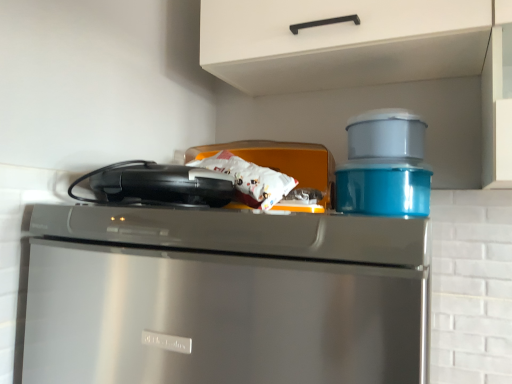
The image size is (512, 384). What do you see at coordinates (224, 297) in the screenshot?
I see `stainless steel dishwasher at upper center` at bounding box center [224, 297].

Identify the location of matte plastic container at upper right, placed as the second appliance when sorted from left to right. (386, 134).

Find the location of a particular element. This screenshot has width=512, height=384. orange plastic container at center, the first appliance when ordered from left to right is located at coordinates (281, 160).

What do you see at coordinates (158, 184) in the screenshot? I see `black plastic toaster at upper left` at bounding box center [158, 184].

Find the location of a particular element. glossy plastic container at upper right, the third appliance from the left is located at coordinates (385, 165).

Can you see orange plastic container at center, the first appliance when ordered from left to right, touching matte plastic container at upper right, the second appliance from the right?

No, orange plastic container at center, the first appliance when ordered from left to right, is not touching matte plastic container at upper right, the second appliance from the right.

Considering the sizes of objects orange plastic container at center, the first appliance when ordered from left to right, and matte plastic container at upper right, placed as the second appliance when sorted from left to right, in the image provided, who is smaller, orange plastic container at center, the first appliance when ordered from left to right, or matte plastic container at upper right, placed as the second appliance when sorted from left to right,?

orange plastic container at center, the first appliance when ordered from left to right, is smaller.

Do you think orange plastic container at center, placed as the 3th appliance when sorted from right to left, is within matte plastic container at upper right, the second appliance from the right, or outside of it?

orange plastic container at center, placed as the 3th appliance when sorted from right to left, is not enclosed by matte plastic container at upper right, the second appliance from the right.

How different are the orientations of orange plastic container at center, the first appliance when ordered from left to right, and matte plastic container at upper right, the second appliance from the right, in degrees?

A: The angle between the facing direction of orange plastic container at center, the first appliance when ordered from left to right, and the facing direction of matte plastic container at upper right, the second appliance from the right, is 0.000131 degrees.

Is white matte cabinet handle at upper center further to camera compared to black plastic toaster at upper left?

Yes, the depth of white matte cabinet handle at upper center is greater than that of black plastic toaster at upper left.

From the image's perspective, which is below, white matte cabinet handle at upper center or black plastic toaster at upper left?

black plastic toaster at upper left appears lower in the image.

From a real-world perspective, is white matte cabinet handle at upper center physically located above or below black plastic toaster at upper left?

Clearly, from a real-world perspective, white matte cabinet handle at upper center is above black plastic toaster at upper left.

Can you confirm if stainless steel dishwasher at upper center is shorter than glossy plastic container at upper right, the third appliance from the left?

Incorrect, the height of stainless steel dishwasher at upper center does not fall short of that of glossy plastic container at upper right, the third appliance from the left.

Based on the photo, from a real-world perspective, which object stands above the other?

glossy plastic container at upper right, the third appliance from the left, from a real-world perspective.

Is stainless steel dishwasher at upper center oriented away from glossy plastic container at upper right, the third appliance from the left?

No, glossy plastic container at upper right, the third appliance from the left, is not at the back of stainless steel dishwasher at upper center.

Which is behind, point (343, 346) or point (362, 118)?

The point (362, 118) is behind.

From the image's perspective, is black plastic toaster at upper left above white matte cabinet handle at upper center?

No, from the image's perspective, black plastic toaster at upper left is not above white matte cabinet handle at upper center.

Is black plastic toaster at upper left located outside white matte cabinet handle at upper center?

Yes.

Which object is further away from the camera, black plastic toaster at upper left or white matte cabinet handle at upper center?

Positioned behind is white matte cabinet handle at upper center.

Between point (203, 182) and point (223, 46), which one is positioned behind?

Positioned behind is point (223, 46).

Is white matte cabinet handle at upper center turned away from matte plastic container at upper right, the second appliance from the right?

No, white matte cabinet handle at upper center is not facing away from matte plastic container at upper right, the second appliance from the right.

Is point (294, 21) positioned after point (353, 120)?

No, it is not.

Is white matte cabinet handle at upper center further to the viewer compared to matte plastic container at upper right, the second appliance from the right?

No, the depth of white matte cabinet handle at upper center is less than that of matte plastic container at upper right, the second appliance from the right.

Who is taller, white matte cabinet handle at upper center or matte plastic container at upper right, placed as the second appliance when sorted from left to right?

white matte cabinet handle at upper center is taller.

Are glossy plastic container at upper right, the third appliance from the left, and white matte cabinet handle at upper center located far from each other?

glossy plastic container at upper right, the third appliance from the left, is near white matte cabinet handle at upper center, not far away.

From a real-world perspective, is glossy plastic container at upper right, the first appliance when ordered from right to left, on top of white matte cabinet handle at upper center?

Incorrect, from a real-world perspective, glossy plastic container at upper right, the first appliance when ordered from right to left, is lower than white matte cabinet handle at upper center.

Can you confirm if glossy plastic container at upper right, the first appliance when ordered from right to left, is thinner than white matte cabinet handle at upper center?

Yes, glossy plastic container at upper right, the first appliance when ordered from right to left, is thinner than white matte cabinet handle at upper center.

Can you confirm if matte plastic container at upper right, the second appliance from the right, is positioned to the left of glossy plastic container at upper right, the first appliance when ordered from right to left?

Correct, you'll find matte plastic container at upper right, the second appliance from the right, to the left of glossy plastic container at upper right, the first appliance when ordered from right to left.

From a real-world perspective, who is located lower, matte plastic container at upper right, placed as the second appliance when sorted from left to right, or glossy plastic container at upper right, the third appliance from the left?

In real-world perspective, glossy plastic container at upper right, the third appliance from the left, is lower.

Identify the location of the 1st appliance in front of the glossy plastic container at upper right, the third appliance from the left. (386, 134).

Is matte plastic container at upper right, placed as the second appliance when sorted from left to right, not close to glossy plastic container at upper right, the first appliance when ordered from right to left?

matte plastic container at upper right, placed as the second appliance when sorted from left to right, is actually quite close to glossy plastic container at upper right, the first appliance when ordered from right to left.

Identify the location of appliance lying in front of the matte plastic container at upper right, the second appliance from the right. Image resolution: width=512 pixels, height=384 pixels. (281, 160).

Find the location of a particular element. The height and width of the screenshot is (384, 512). shelf above the black plastic toaster at upper left (from the image's perspective) is located at coordinates (341, 42).

Which object lies further to the anchor point black plastic toaster at upper left, orange plastic container at center, the first appliance when ordered from left to right, or matte plastic container at upper right, the second appliance from the right?

matte plastic container at upper right, the second appliance from the right, is further to black plastic toaster at upper left.

When comparing their distances from glossy plastic container at upper right, the third appliance from the left, does orange plastic container at center, placed as the 3th appliance when sorted from right to left, or white matte cabinet handle at upper center seem further?

The object further to glossy plastic container at upper right, the third appliance from the left, is white matte cabinet handle at upper center.

Considering their positions, is stainless steel dishwasher at upper center positioned closer to glossy plastic container at upper right, the third appliance from the left, than white matte cabinet handle at upper center?

Among the two, white matte cabinet handle at upper center is located nearer to glossy plastic container at upper right, the third appliance from the left.

Considering their positions, is stainless steel dishwasher at upper center positioned closer to orange plastic container at center, placed as the 3th appliance when sorted from right to left, than glossy plastic container at upper right, the third appliance from the left?

glossy plastic container at upper right, the third appliance from the left, is positioned closer to the anchor orange plastic container at center, placed as the 3th appliance when sorted from right to left.

Looking at this image, estimate the real-world distances between objects in this image. Which object is further from stainless steel dishwasher at upper center, matte plastic container at upper right, placed as the second appliance when sorted from left to right, or black plastic toaster at upper left?

matte plastic container at upper right, placed as the second appliance when sorted from left to right, lies further to stainless steel dishwasher at upper center than the other object.

Estimate the real-world distances between objects in this image. Which object is closer to stainless steel dishwasher at upper center, orange plastic container at center, placed as the 3th appliance when sorted from right to left, or white matte cabinet handle at upper center?

orange plastic container at center, placed as the 3th appliance when sorted from right to left, is positioned closer to the anchor stainless steel dishwasher at upper center.

Which object lies nearer to the anchor point white matte cabinet handle at upper center, black plastic toaster at upper left or matte plastic container at upper right, the second appliance from the right?

Among the two, matte plastic container at upper right, the second appliance from the right, is located nearer to white matte cabinet handle at upper center.

Considering their positions, is white matte cabinet handle at upper center positioned further to stainless steel dishwasher at upper center than matte plastic container at upper right, placed as the second appliance when sorted from left to right?

The object further to stainless steel dishwasher at upper center is white matte cabinet handle at upper center.

Find the location of a particular element. appliance between orange plastic container at center, placed as the 3th appliance when sorted from right to left, and glossy plastic container at upper right, the third appliance from the left, from left to right is located at coordinates (386, 134).

Where is `kitchen appliance between white matte cabinet handle at upper center and stainless steel dishwasher at upper center from top to bottom`? kitchen appliance between white matte cabinet handle at upper center and stainless steel dishwasher at upper center from top to bottom is located at coordinates (158, 184).

Image resolution: width=512 pixels, height=384 pixels. In order to click on home appliance between black plastic toaster at upper left and glossy plastic container at upper right, the third appliance from the left, from left to right in this screenshot , I will do `click(224, 297)`.

Identify the location of kitchen appliance between matte plastic container at upper right, the second appliance from the right, and stainless steel dishwasher at upper center vertically. (158, 184).